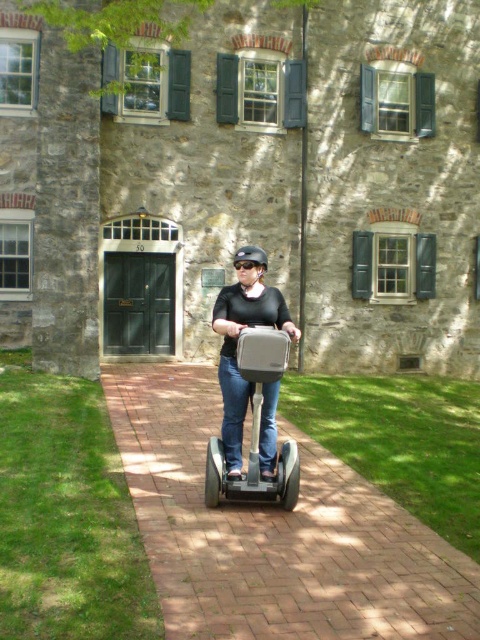
You are a delivery person who needs to secure your black matte helmet at center onto the matte gray scooter at center. Based on the scene, can you determine if the helmet will fit in the space between the scooter and the building?

The matte gray scooter at center is in front of the black matte helmet at center, meaning the helmet is positioned behind the scooter. Since the helmet is behind the scooter and the building is behind the pathway, there is sufficient space between the scooter and the building to secure the helmet.

You are standing at the entrance of the stone building marked with the number 50. You want to reach the brick pavement at center. Which direction should you walk to get there?

The brick pavement at center is located at point (275, 532), so you should walk forward from the entrance to reach it.

You are standing at point A located at coordinates point A at [167,540]. You want to walk to point B, which is 15.53 feet away from point A. Is there enough space between the Segway and the building to walk comfortably?

The distance between point A and point B is 15.53 feet, so there is sufficient space to walk comfortably between the Segway and the building.